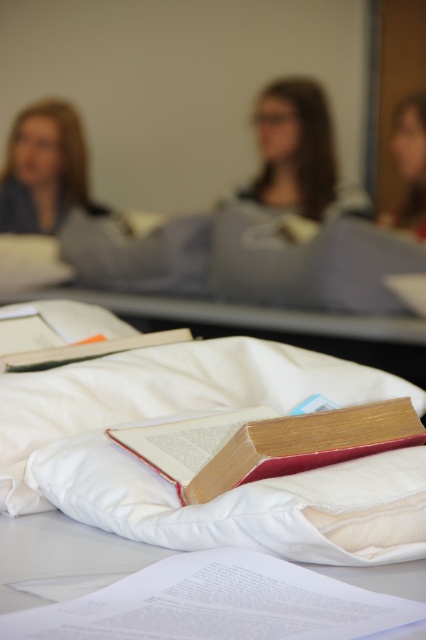
Describe the element at coordinates (267, 444) in the screenshot. I see `hardcover book at center` at that location.

Does hardcover book at center appear on the right side of white fabric at lower center?

Correct, you'll find hardcover book at center to the right of white fabric at lower center.

Who is more distant from viewer, (262, 420) or (65, 556)?

Point (262, 420)

You are a GUI agent. You are given a task and a screenshot of the screen. Output one action in this format:
    pyautogui.click(x=<x>, y=<y>)
    Task: Click on the hardcover book at center
    
    Given the screenshot: What is the action you would take?
    pyautogui.click(x=267, y=444)

Between matte blue shirt at left and hardcover book at lower left, which one has less height?

Standing shorter between the two is hardcover book at lower left.

Does point (66, 205) lie behind point (13, 356)?

Yes.

Locate an element on the screen. The height and width of the screenshot is (640, 426). matte blue shirt at left is located at coordinates (45, 170).

Is white fabric at lower center thinner than hardcover book at lower left?

No, white fabric at lower center is not thinner than hardcover book at lower left.

Who is taller, white fabric at lower center or hardcover book at lower left?

hardcover book at lower left

Locate an element on the screen. white fabric at lower center is located at coordinates click(x=62, y=557).